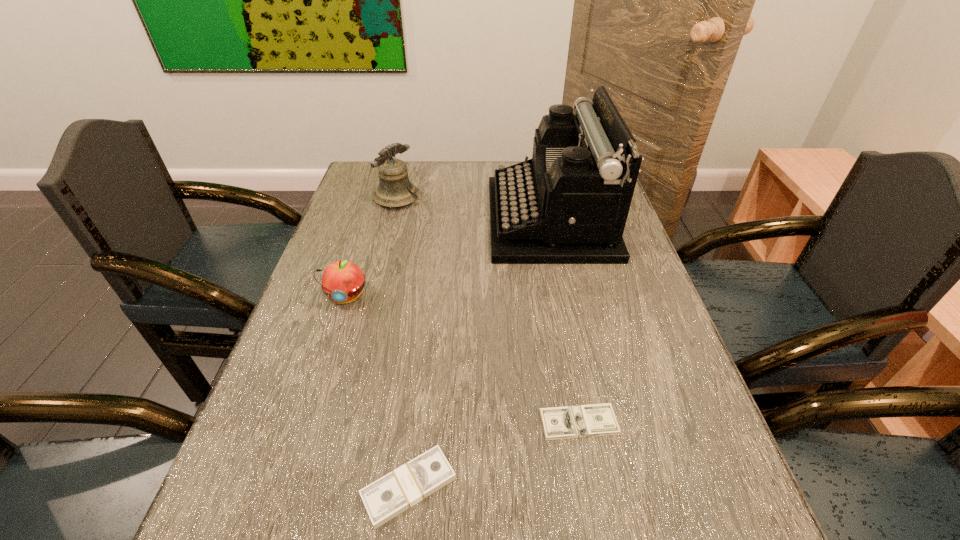
This screenshot has height=540, width=960. I want to click on free area in between the second shortest object and the third farthest object, so click(377, 392).

The height and width of the screenshot is (540, 960). Find the location of `vacant region between the bell and the third shortest object`. vacant region between the bell and the third shortest object is located at coordinates (372, 247).

Locate an element on the screen. The width and height of the screenshot is (960, 540). blank region between the bell and the nearer dollar is located at coordinates (403, 343).

Identify the location of empty space between the bell and the right dollar. (488, 310).

The image size is (960, 540). In order to click on object that stands as the fourth closest to the bell in this screenshot , I will do `click(397, 491)`.

Locate an element on the screen. This screenshot has width=960, height=540. the fourth closest object relative to the fourth shortest object is located at coordinates 397,491.

You are a GUI agent. You are given a task and a screenshot of the screen. Output one action in this format:
    pyautogui.click(x=<x>, y=<y>)
    Task: Click on the vacant space that satisfies the following two spatial constraints: 1. on the front side of the third nearest object; 2. on the left side of the left dollar
    Image resolution: width=960 pixels, height=540 pixels.
    Given the screenshot: What is the action you would take?
    pyautogui.click(x=284, y=487)

In order to click on vacant point that satisfies the following two spatial constraints: 1. on the typing side of the typewriter; 2. on the front side of the right dollar in this screenshot , I will do `click(592, 422)`.

Identify the location of blank space that satisfies the following two spatial constraints: 1. on the back side of the left dollar; 2. on the left side of the farther dollar. The width and height of the screenshot is (960, 540). (417, 422).